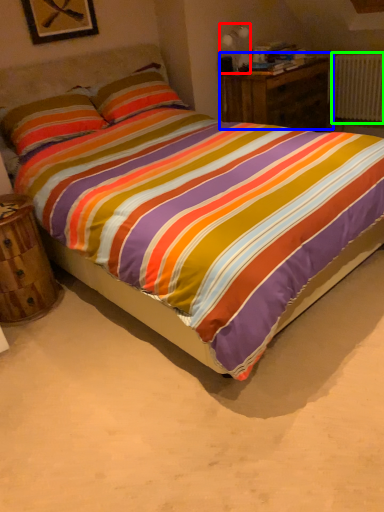
Question: Which object is the farthest from table lamp (highlighted by a red box)? Choose among these: nightstand (highlighted by a blue box) or radiator (highlighted by a green box).

Choices:
 (A) nightstand
 (B) radiator

Answer: (B)